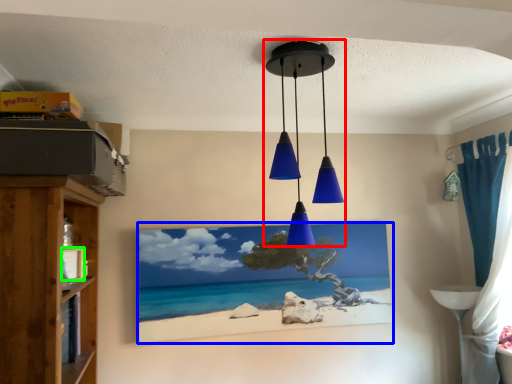
Question: Considering the real-world distances, which object is closest to lamp (highlighted by a red box)? picture frame (highlighted by a blue box) or picture frame (highlighted by a green box).

Choices:
 (A) picture frame
 (B) picture frame

Answer: (A)